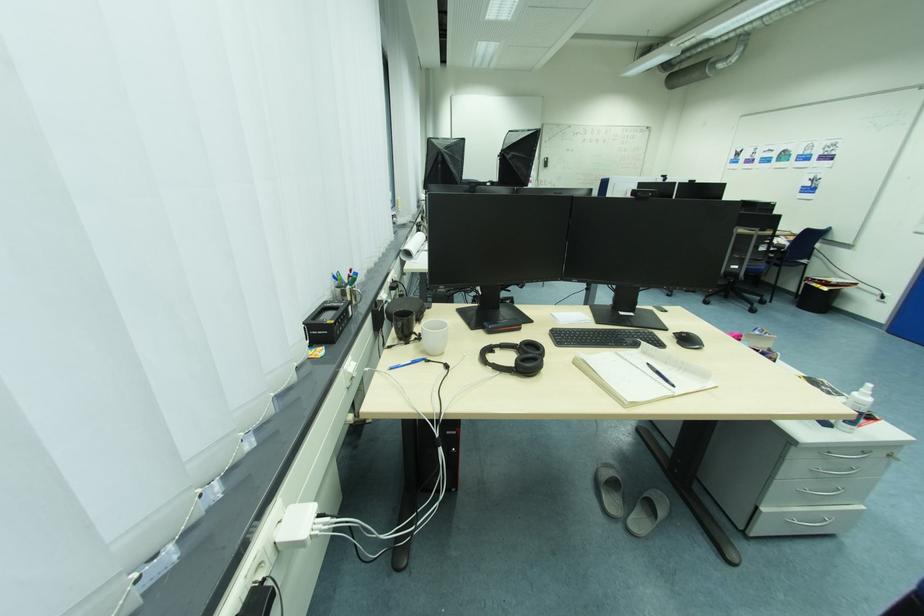
Where would you lift the white spray bottle? Please return your answer as a coordinate pair (x, y).

(857, 407)